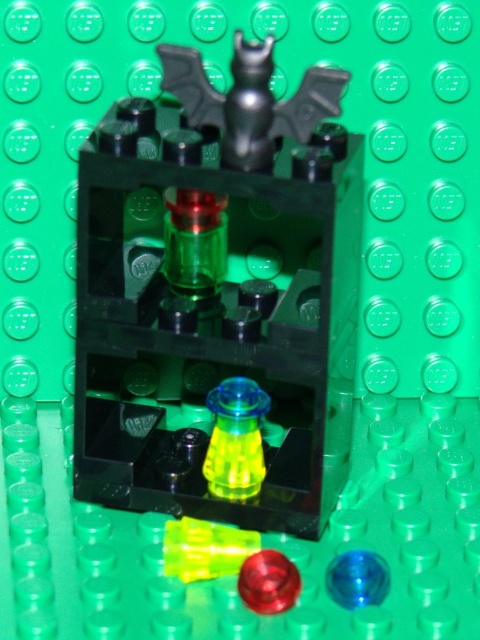
Question: Which of the following is the closest to the observer?

Choices:
 (A) shiny red button at center
 (B) transparent blue sphere at center
 (C) transparent plastic bat at upper center
 (D) translucent yellow plastic at center

Answer: (C)

Question: Can you confirm if transparent plastic bat at upper center is wider than translucent yellow plastic at center?

Choices:
 (A) no
 (B) yes

Answer: (B)

Question: Does transparent plastic bat at upper center lie in front of shiny red button at center?

Choices:
 (A) yes
 (B) no

Answer: (A)

Question: Among these points, which one is nearest to the camera?

Choices:
 (A) (254, 592)
 (B) (132, 396)
 (C) (216, 428)

Answer: (A)

Question: Which object is the farthest from the shiny red button at center?

Choices:
 (A) transparent plastic bat at upper center
 (B) translucent yellow plastic at center
 (C) transparent blue sphere at center

Answer: (A)

Question: Is transparent plastic bat at upper center below shiny red button at center?

Choices:
 (A) no
 (B) yes

Answer: (A)